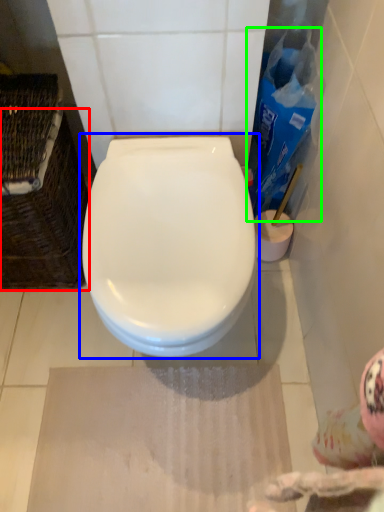
Question: Which is farther away from basket (highlighted by a red box)? toilet (highlighted by a blue box) or cleaning product (highlighted by a green box)?

Choices:
 (A) toilet
 (B) cleaning product

Answer: (B)